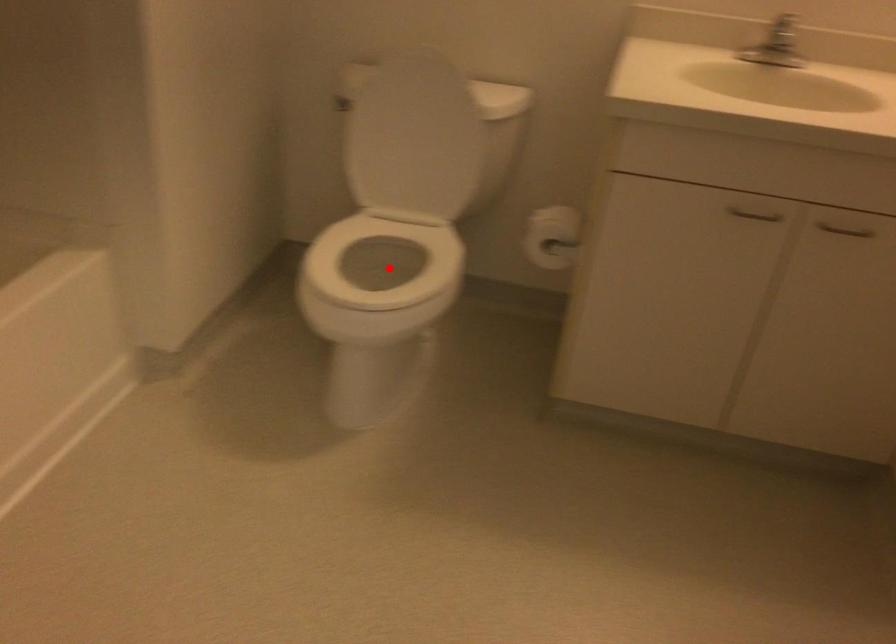
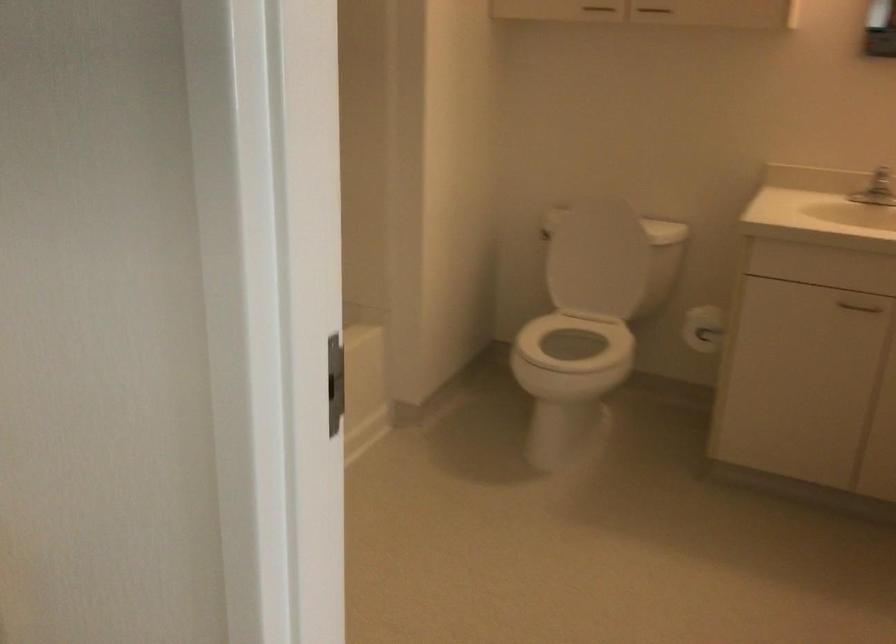
The point at the highlighted location is marked in the first image. Where is the corresponding point in the second image?

(571, 357)